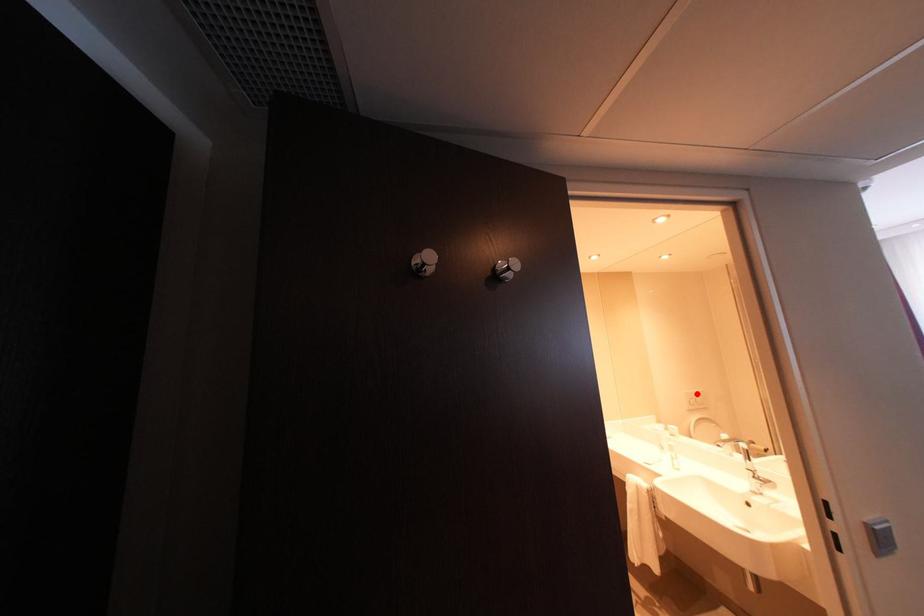
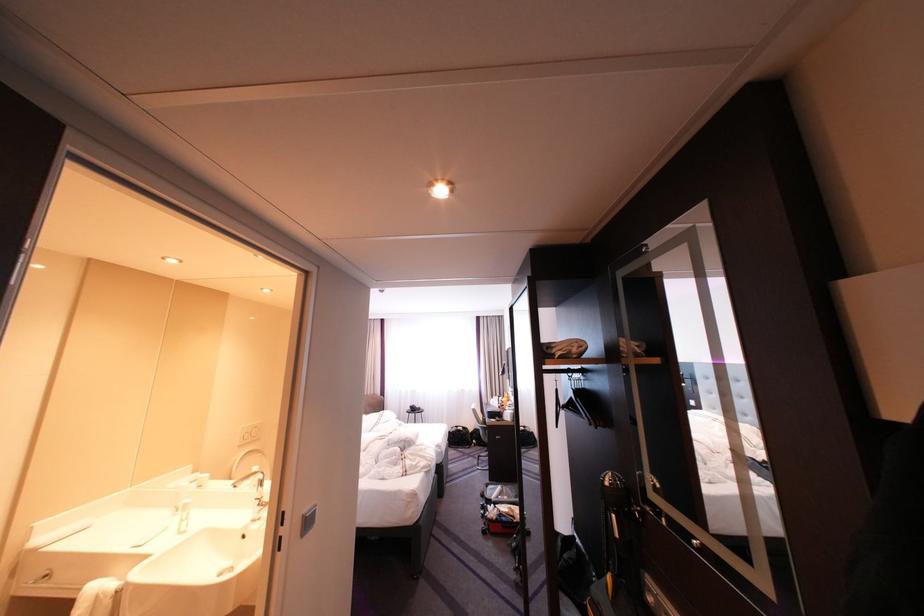
Locate, in the second image, the point that corresponds to the highlighted location in the first image.

(254, 429)